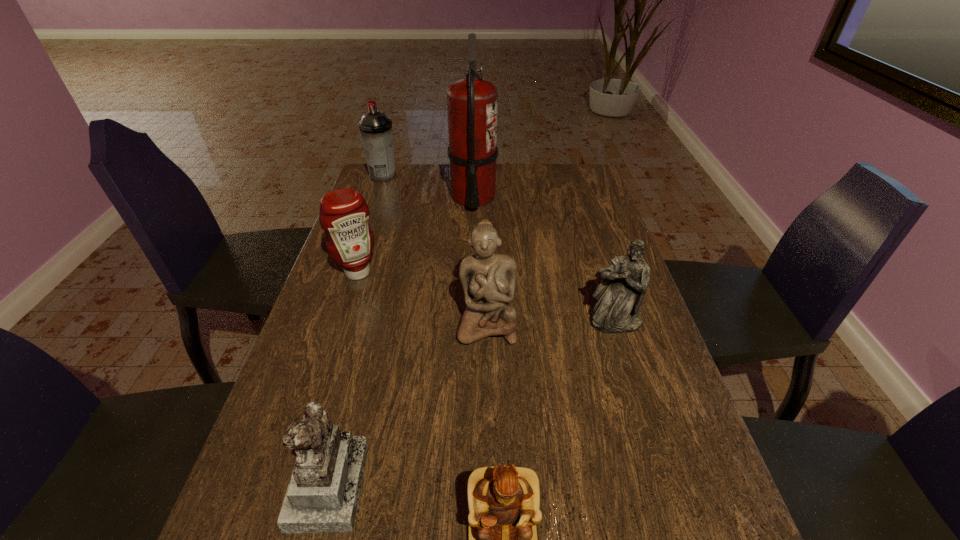
This screenshot has width=960, height=540. I want to click on fire extinguisher that is positioned at the far edge, so click(x=472, y=103).

Where is `aerosol can located at the far edge`? aerosol can located at the far edge is located at coordinates (375, 127).

What are the coordinates of `aerosol can at the left edge` in the screenshot? It's located at click(375, 127).

Find the location of a particular element. condiment at the left edge is located at coordinates (344, 215).

This screenshot has width=960, height=540. I want to click on figurine that is at the left edge, so click(x=323, y=495).

This screenshot has width=960, height=540. I want to click on object that is at the right edge, so click(620, 293).

You are a GUI agent. You are given a task and a screenshot of the screen. Output one action in this format:
    pyautogui.click(x=<x>, y=<y>)
    Task: Click on the object situated at the far left corner
    The image size is (960, 540).
    Given the screenshot: What is the action you would take?
    pyautogui.click(x=375, y=127)

In the image, there is a desktop. Where is `vacant area at the far edge`? This screenshot has height=540, width=960. vacant area at the far edge is located at coordinates (518, 187).

Identify the location of vacant space at the left edge of the desktop. (303, 411).

Locate an element on the screen. This screenshot has height=540, width=960. vacant space at the right edge is located at coordinates (657, 363).